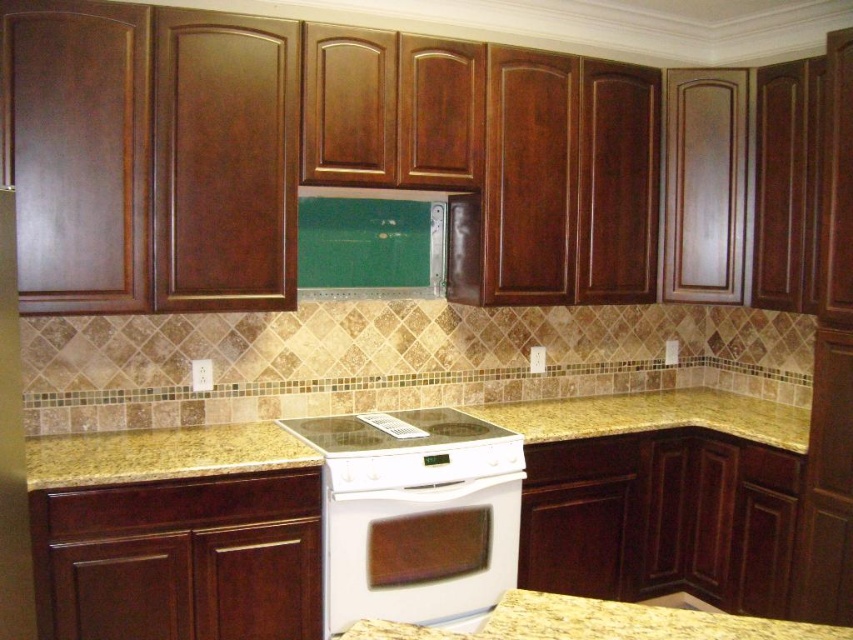
Which is more to the right, green glass exhaust hood at center or white glossy stove at center?

white glossy stove at center is more to the right.

Can you confirm if green glass exhaust hood at center is positioned below white glossy stove at center?

Incorrect, green glass exhaust hood at center is not positioned below white glossy stove at center.

The width and height of the screenshot is (853, 640). I want to click on green glass exhaust hood at center, so click(x=370, y=244).

The height and width of the screenshot is (640, 853). In order to click on green glass exhaust hood at center in this screenshot , I will do `click(370, 244)`.

Can you confirm if white glossy stove at center is positioned to the left of yellow granite countertop at lower center?

Correct, you'll find white glossy stove at center to the left of yellow granite countertop at lower center.

Is white glossy stove at center smaller than yellow granite countertop at lower center?

No, white glossy stove at center is not smaller than yellow granite countertop at lower center.

You are a GUI agent. You are given a task and a screenshot of the screen. Output one action in this format:
    pyautogui.click(x=<x>, y=<y>)
    Task: Click on the white glossy stove at center
    This screenshot has width=853, height=640.
    Given the screenshot: What is the action you would take?
    pyautogui.click(x=408, y=449)

This screenshot has width=853, height=640. What are the coordinates of `white glossy stove at center` in the screenshot? It's located at (408, 449).

Between yellow granite countertop at center and yellow granite countertop at lower center, which one has less height?

yellow granite countertop at lower center

Is yellow granite countertop at center positioned behind yellow granite countertop at lower center?

Yes.

I want to click on yellow granite countertop at center, so click(x=161, y=452).